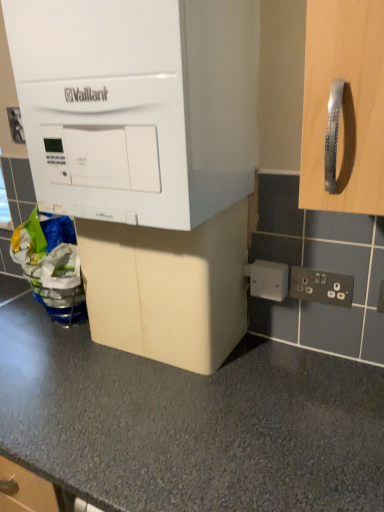
The width and height of the screenshot is (384, 512). What do you see at coordinates (138, 105) in the screenshot?
I see `white matte vaillant boiler at upper left, arranged as the first cabinetry when viewed from the top` at bounding box center [138, 105].

The width and height of the screenshot is (384, 512). Identify the location of black plastic electrical outlet at lower right, which appears as the first electric outlet when viewed from the front. (321, 287).

Is black plastic electrical outlet at lower right, acting as the 3th electric outlet starting from the back, not near beige matte cabinet at center, which appears as the 2th cabinetry when viewed from the top?

black plastic electrical outlet at lower right, acting as the 3th electric outlet starting from the back, is near beige matte cabinet at center, which appears as the 2th cabinetry when viewed from the top, not far away.

Looking at this image, can beige matte cabinet at center, acting as the 1th cabinetry starting from the bottom, be found inside black plastic electrical outlet at lower right, which appears as the first electric outlet when viewed from the front?

No, beige matte cabinet at center, acting as the 1th cabinetry starting from the bottom, is not surrounded by black plastic electrical outlet at lower right, which appears as the first electric outlet when viewed from the front.

From the image's perspective, between black plastic electrical outlet at lower right, the first electric outlet from the bottom, and beige matte cabinet at center, which appears as the 2th cabinetry when viewed from the top, which one is located above?

From the image's view, beige matte cabinet at center, which appears as the 2th cabinetry when viewed from the top, is above.

From the picture: Could you tell me if black plastic electrical outlet at lower right, which ranks as the 3th electric outlet in left-to-right order, is turned towards beige matte cabinet at center, acting as the 1th cabinetry starting from the bottom?

No, black plastic electrical outlet at lower right, which ranks as the 3th electric outlet in left-to-right order, is not facing towards beige matte cabinet at center, acting as the 1th cabinetry starting from the bottom.

Between black plastic electrical outlet at lower right, which ranks as the 3th electric outlet in left-to-right order, and white plastic electric outlet at lower right, the second electric outlet from the top, which one has larger width?

white plastic electric outlet at lower right, the second electric outlet from the top, is wider.

Is black plastic electrical outlet at lower right, arranged as the 3th electric outlet when viewed from the top, inside or outside of white plastic electric outlet at lower right, the 2th electric outlet when ordered from bottom to top?

black plastic electrical outlet at lower right, arranged as the 3th electric outlet when viewed from the top, is spatially situated outside white plastic electric outlet at lower right, the 2th electric outlet when ordered from bottom to top.

Would you consider black plastic electrical outlet at lower right, marked as the 1th electric outlet in a right-to-left arrangement, to be distant from white plastic electric outlet at lower right, arranged as the second electric outlet when viewed from the right?

No, black plastic electrical outlet at lower right, marked as the 1th electric outlet in a right-to-left arrangement, is not far from white plastic electric outlet at lower right, arranged as the second electric outlet when viewed from the right.

Which object is closer to the camera taking this photo, black plastic electrical outlet at lower right, marked as the 1th electric outlet in a right-to-left arrangement, or white plastic electric outlet at lower right, the second electric outlet when ordered from left to right?

black plastic electrical outlet at lower right, marked as the 1th electric outlet in a right-to-left arrangement, is in front.

Considering the sizes of objects white plastic electric outlet at lower right, the second electric outlet when ordered from left to right, and black plastic electrical outlet at lower right, which appears as the first electric outlet when viewed from the front, in the image provided, who is bigger, white plastic electric outlet at lower right, the second electric outlet when ordered from left to right, or black plastic electrical outlet at lower right, which appears as the first electric outlet when viewed from the front,?

With larger size is white plastic electric outlet at lower right, the second electric outlet when ordered from left to right.

How many degrees apart are the facing directions of white plastic electric outlet at lower right, the 2th electric outlet in the front-to-back sequence, and black plastic electrical outlet at lower right, which appears as the first electric outlet when viewed from the front?

0.00708 degrees separate the facing orientations of white plastic electric outlet at lower right, the 2th electric outlet in the front-to-back sequence, and black plastic electrical outlet at lower right, which appears as the first electric outlet when viewed from the front.

Is white plastic electric outlet at lower right, the second electric outlet when ordered from left to right, not close to black plastic electrical outlet at lower right, which appears as the first electric outlet when viewed from the front?

No.

From a real-world perspective, which is physically below, white plastic electric outlet at lower right, the second electric outlet when ordered from back to front, or black plastic electrical outlet at lower right, the first electric outlet from the bottom?

From a 3D spatial view, black plastic electrical outlet at lower right, the first electric outlet from the bottom, is below.

Looking at this image, do you think beige matte cabinet at center, which appears as the 2th cabinetry when viewed from the top, is within black plastic electrical outlet at lower right, marked as the 1th electric outlet in a right-to-left arrangement, or outside of it?

beige matte cabinet at center, which appears as the 2th cabinetry when viewed from the top, is spatially situated outside black plastic electrical outlet at lower right, marked as the 1th electric outlet in a right-to-left arrangement.

Relative to black plastic electrical outlet at lower right, acting as the 3th electric outlet starting from the back, is beige matte cabinet at center, acting as the 1th cabinetry starting from the bottom, in front or behind?

beige matte cabinet at center, acting as the 1th cabinetry starting from the bottom, is in front of black plastic electrical outlet at lower right, acting as the 3th electric outlet starting from the back.

Is beige matte cabinet at center, which appears as the 2th cabinetry when viewed from the top, aimed at black plastic electrical outlet at lower right, marked as the 1th electric outlet in a right-to-left arrangement?

No.

How different are the orientations of beige matte cabinet at center, which appears as the 2th cabinetry when viewed from the top, and black plastic electrical outlet at lower right, marked as the 1th electric outlet in a right-to-left arrangement, in degrees?

The angular difference between beige matte cabinet at center, which appears as the 2th cabinetry when viewed from the top, and black plastic electrical outlet at lower right, marked as the 1th electric outlet in a right-to-left arrangement, is 0.00716 degrees.

Is white plastic electric outlet at upper left, which appears as the 1th electric outlet when viewed from the back, at the right side of black plastic electrical outlet at lower right, acting as the 3th electric outlet starting from the back?

Incorrect, white plastic electric outlet at upper left, which appears as the 1th electric outlet when viewed from the back, is not on the right side of black plastic electrical outlet at lower right, acting as the 3th electric outlet starting from the back.

From the picture: Considering the sizes of white plastic electric outlet at upper left, the 3th electric outlet when ordered from bottom to top, and black plastic electrical outlet at lower right, which appears as the first electric outlet when viewed from the front, in the image, is white plastic electric outlet at upper left, the 3th electric outlet when ordered from bottom to top, wider or thinner than black plastic electrical outlet at lower right, which appears as the first electric outlet when viewed from the front,?

white plastic electric outlet at upper left, the 3th electric outlet when ordered from bottom to top, is wider than black plastic electrical outlet at lower right, which appears as the first electric outlet when viewed from the front.

Is white plastic electric outlet at upper left, positioned as the 3th electric outlet in front-to-back order, looking in the opposite direction of black plastic electrical outlet at lower right, which appears as the first electric outlet when viewed from the front?

That's not correct — white plastic electric outlet at upper left, positioned as the 3th electric outlet in front-to-back order, is not looking away from black plastic electrical outlet at lower right, which appears as the first electric outlet when viewed from the front.

Is white plastic electric outlet at upper left, acting as the first electric outlet starting from the left, far from white plastic electric outlet at lower right, the second electric outlet when ordered from back to front?

white plastic electric outlet at upper left, acting as the first electric outlet starting from the left, is near white plastic electric outlet at lower right, the second electric outlet when ordered from back to front, not far away.

How much distance is there between white plastic electric outlet at upper left, which is counted as the 1th electric outlet, starting from the top, and white plastic electric outlet at lower right, the second electric outlet when ordered from left to right?

They are 35.22 inches apart.

Which is in front, point (11, 116) or point (273, 270)?

Point (273, 270)

Is white plastic electric outlet at upper left, which is counted as the 1th electric outlet, starting from the top, spatially inside white plastic electric outlet at lower right, the 2th electric outlet in the front-to-back sequence, or outside of it?

white plastic electric outlet at upper left, which is counted as the 1th electric outlet, starting from the top, is outside white plastic electric outlet at lower right, the 2th electric outlet in the front-to-back sequence.

Is white matte vaillant boiler at upper left, the second cabinetry when ordered from bottom to top, oriented towards black plastic electrical outlet at lower right, arranged as the 3th electric outlet when viewed from the top?

No, white matte vaillant boiler at upper left, the second cabinetry when ordered from bottom to top, is not facing towards black plastic electrical outlet at lower right, arranged as the 3th electric outlet when viewed from the top.

Considering the sizes of white matte vaillant boiler at upper left, arranged as the first cabinetry when viewed from the top, and black plastic electrical outlet at lower right, which ranks as the 3th electric outlet in left-to-right order, in the image, is white matte vaillant boiler at upper left, arranged as the first cabinetry when viewed from the top, bigger or smaller than black plastic electrical outlet at lower right, which ranks as the 3th electric outlet in left-to-right order,?

Clearly, white matte vaillant boiler at upper left, arranged as the first cabinetry when viewed from the top, is larger in size than black plastic electrical outlet at lower right, which ranks as the 3th electric outlet in left-to-right order.

From the image's perspective, which is below, white matte vaillant boiler at upper left, the second cabinetry when ordered from bottom to top, or black plastic electrical outlet at lower right, arranged as the 3th electric outlet when viewed from the top?

black plastic electrical outlet at lower right, arranged as the 3th electric outlet when viewed from the top, is shown below in the image.

Which is in front, white matte vaillant boiler at upper left, the second cabinetry when ordered from bottom to top, or black plastic electrical outlet at lower right, which appears as the first electric outlet when viewed from the front?

white matte vaillant boiler at upper left, the second cabinetry when ordered from bottom to top.

From a real-world perspective, count 1st cabinetrys upward from the black plastic electrical outlet at lower right, the first electric outlet from the bottom, and point to it. Please provide its 2D coordinates.

[(168, 288)]

What are the coordinates of `electric outlet beneath the white plastic electric outlet at lower right, the second electric outlet when ordered from back to front (from a real-world perspective)` in the screenshot? It's located at (321, 287).

Which object lies nearer to the anchor point white plastic electric outlet at lower right, arranged as the second electric outlet when viewed from the right, white plastic electric outlet at upper left, the 3th electric outlet when ordered from bottom to top, or white matte vaillant boiler at upper left, the second cabinetry when ordered from bottom to top?

Based on the image, white matte vaillant boiler at upper left, the second cabinetry when ordered from bottom to top, appears to be nearer to white plastic electric outlet at lower right, arranged as the second electric outlet when viewed from the right.

From the image, which object appears to be nearer to white plastic electric outlet at upper left, the 3th electric outlet positioned from the right, white matte vaillant boiler at upper left, arranged as the first cabinetry when viewed from the top, or beige matte cabinet at center, acting as the 1th cabinetry starting from the bottom?

Among the two, white matte vaillant boiler at upper left, arranged as the first cabinetry when viewed from the top, is located nearer to white plastic electric outlet at upper left, the 3th electric outlet positioned from the right.

Considering their positions, is beige matte cabinet at center, which appears as the 2th cabinetry when viewed from the top, positioned further to white plastic electric outlet at lower right, the 2th electric outlet in the front-to-back sequence, than black plastic electrical outlet at lower right, which appears as the first electric outlet when viewed from the front?

Among the two, beige matte cabinet at center, which appears as the 2th cabinetry when viewed from the top, is located further to white plastic electric outlet at lower right, the 2th electric outlet in the front-to-back sequence.

Based on the photo, based on their spatial positions, is black plastic electrical outlet at lower right, arranged as the 3th electric outlet when viewed from the top, or beige matte cabinet at center, which appears as the 2th cabinetry when viewed from the top, further from white plastic electric outlet at lower right, the second electric outlet when ordered from back to front?

The object further to white plastic electric outlet at lower right, the second electric outlet when ordered from back to front, is beige matte cabinet at center, which appears as the 2th cabinetry when viewed from the top.

When comparing their distances from black plastic electrical outlet at lower right, which appears as the first electric outlet when viewed from the front, does white plastic electric outlet at lower right, the second electric outlet when ordered from left to right, or white plastic electric outlet at upper left, which is counted as the 1th electric outlet, starting from the top, seem further?

The object further to black plastic electrical outlet at lower right, which appears as the first electric outlet when viewed from the front, is white plastic electric outlet at upper left, which is counted as the 1th electric outlet, starting from the top.

From the image, which object appears to be farther from white plastic electric outlet at upper left, the 3th electric outlet positioned from the right, white plastic electric outlet at lower right, the second electric outlet when ordered from back to front, or white matte vaillant boiler at upper left, the second cabinetry when ordered from bottom to top?

The object further to white plastic electric outlet at upper left, the 3th electric outlet positioned from the right, is white plastic electric outlet at lower right, the second electric outlet when ordered from back to front.

From the image, which object appears to be nearer to white plastic electric outlet at lower right, the 2th electric outlet in the front-to-back sequence, white matte vaillant boiler at upper left, the second cabinetry when ordered from bottom to top, or beige matte cabinet at center, acting as the 1th cabinetry starting from the bottom?

beige matte cabinet at center, acting as the 1th cabinetry starting from the bottom, lies closer to white plastic electric outlet at lower right, the 2th electric outlet in the front-to-back sequence, than the other object.

Consider the image. Looking at the image, which one is located further to white matte vaillant boiler at upper left, arranged as the first cabinetry when viewed from the top, beige matte cabinet at center, which appears as the 2th cabinetry when viewed from the top, or black plastic electrical outlet at lower right, the first electric outlet from the bottom?

The object further to white matte vaillant boiler at upper left, arranged as the first cabinetry when viewed from the top, is black plastic electrical outlet at lower right, the first electric outlet from the bottom.

Where is `electric outlet between beige matte cabinet at center, which appears as the 2th cabinetry when viewed from the top, and black plastic electrical outlet at lower right, which appears as the first electric outlet when viewed from the front, in the horizontal direction`? This screenshot has width=384, height=512. electric outlet between beige matte cabinet at center, which appears as the 2th cabinetry when viewed from the top, and black plastic electrical outlet at lower right, which appears as the first electric outlet when viewed from the front, in the horizontal direction is located at coordinates (268, 279).

Locate an element on the screen. The width and height of the screenshot is (384, 512). electric outlet between white matte vaillant boiler at upper left, arranged as the first cabinetry when viewed from the top, and white plastic electric outlet at lower right, the 2th electric outlet when ordered from bottom to top, in the front-back direction is located at coordinates (321, 287).

The width and height of the screenshot is (384, 512). I want to click on cabinetry between white matte vaillant boiler at upper left, the second cabinetry when ordered from bottom to top, and white plastic electric outlet at upper left, which appears as the 1th electric outlet when viewed from the back, from front to back, so click(x=168, y=288).

The image size is (384, 512). What are the coordinates of `cabinetry situated between white matte vaillant boiler at upper left, arranged as the first cabinetry when viewed from the top, and black plastic electrical outlet at lower right, which ranks as the 3th electric outlet in left-to-right order, from left to right` in the screenshot? It's located at (168, 288).